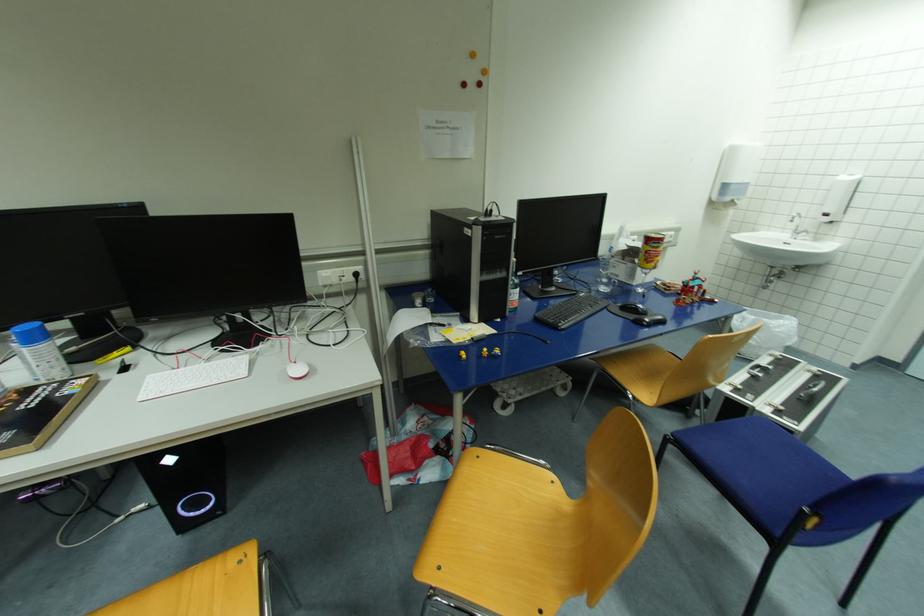
Find where to open the black hardcover book. Please return your answer as a coordinate pair (x, y).

(39, 411)